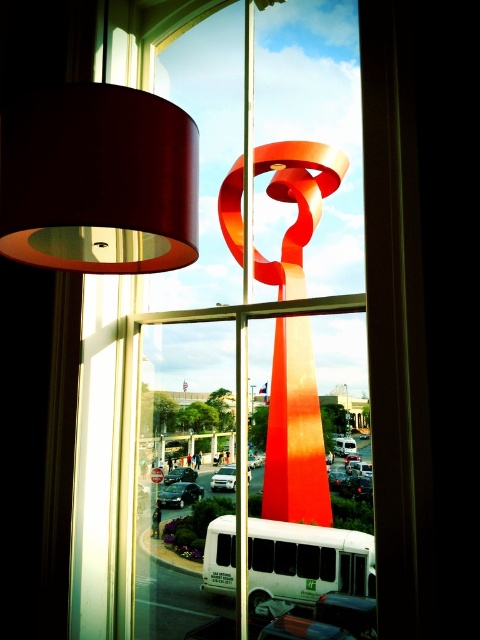
Question: Which object is farther from the camera taking this photo?

Choices:
 (A) matte brown lampshade at upper left
 (B) matte glass window at center
 (C) shiny orange ribbon at center

Answer: (C)

Question: Considering the real-world distances, which object is closest to the matte brown lampshade at upper left?

Choices:
 (A) matte glass window at center
 (B) shiny orange ribbon at center

Answer: (A)

Question: Which point is closer to the camera taking this photo?

Choices:
 (A) [x=80, y=545]
 (B) [x=320, y=422]

Answer: (A)

Question: Is matte glass window at center in front of matte brown lampshade at upper left?

Choices:
 (A) no
 (B) yes

Answer: (A)

Question: Does matte glass window at center have a larger size compared to shiny orange ribbon at center?

Choices:
 (A) no
 (B) yes

Answer: (B)

Question: In this image, where is matte brown lampshade at upper left located relative to shiny orange ribbon at center?

Choices:
 (A) above
 (B) below

Answer: (A)